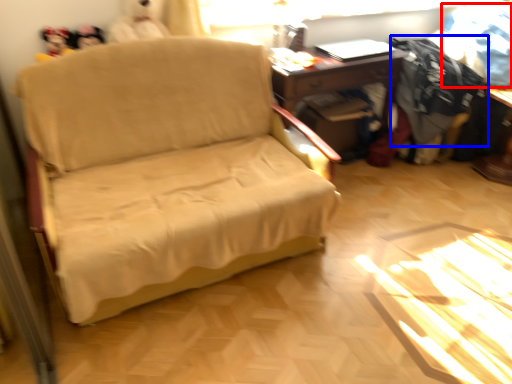
Question: Which object appears farthest to the camera in this image, clothing (highlighted by a red box) or clothing (highlighted by a blue box)?

Choices:
 (A) clothing
 (B) clothing

Answer: (B)